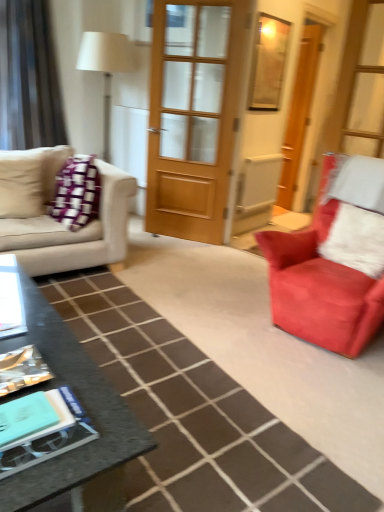
Locate an element on the screen. This screenshot has height=512, width=384. free space on the front side of wooden door at center, the 1th door viewed from the left is located at coordinates pyautogui.click(x=177, y=258).